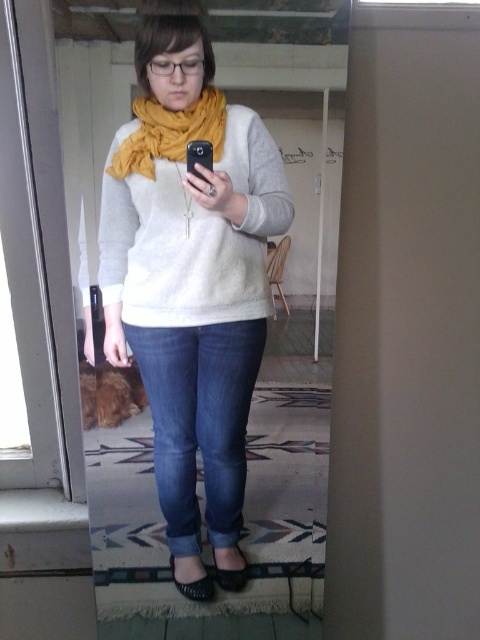
Can you confirm if yellow soft scarf at center is bigger than leather at lower center?

Correct, yellow soft scarf at center is larger in size than leather at lower center.

In order to click on yellow soft scarf at center in this screenshot , I will do `click(168, 132)`.

Does matte white sweater at center come in front of fuzzy white sweater at center?

Yes, matte white sweater at center is in front of fuzzy white sweater at center.

Can you confirm if matte white sweater at center is positioned to the left of fuzzy white sweater at center?

Yes, matte white sweater at center is to the left of fuzzy white sweater at center.

The height and width of the screenshot is (640, 480). What do you see at coordinates (190, 273) in the screenshot?
I see `matte white sweater at center` at bounding box center [190, 273].

Image resolution: width=480 pixels, height=640 pixels. In order to click on matte white sweater at center in this screenshot , I will do `click(190, 273)`.

Consider the image. Does fuzzy white sweater at center have a greater width compared to black leather sandal at lower center?

Indeed, fuzzy white sweater at center has a greater width compared to black leather sandal at lower center.

Does fuzzy white sweater at center appear over black leather sandal at lower center?

Yes, fuzzy white sweater at center is above black leather sandal at lower center.

I want to click on fuzzy white sweater at center, so click(x=193, y=236).